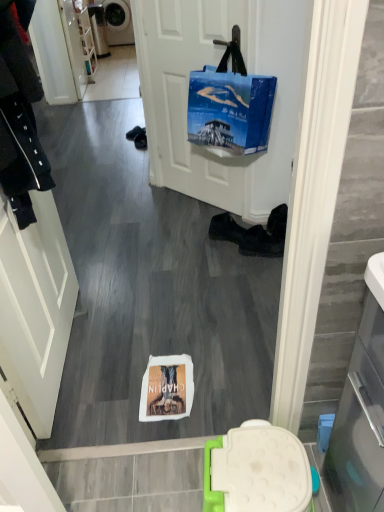
Question: From a real-world perspective, relative to white glossy door at left, is black leather shoe at lower center vertically above or below?

Choices:
 (A) below
 (B) above

Answer: (A)

Question: Considering the positions of point (274, 216) and point (33, 364), is point (274, 216) closer or farther from the camera than point (33, 364)?

Choices:
 (A) farther
 (B) closer

Answer: (A)

Question: Which object is positioned farthest from the white matte door at center?

Choices:
 (A) metallic gray washing machine at upper left
 (B) black leather shoe at lower center
 (C) black leather shoes at center, which ranks as the first footwear in left-to-right order
 (D) white glossy door at left
 (E) black leather boots at lower center, arranged as the 1th footwear when viewed from the right

Answer: (A)

Question: Estimate the real-world distances between objects in this image. Which object is farther from the matte white cabinet at upper left?

Choices:
 (A) blue fabric bag at upper center
 (B) white matte door at center
 (C) black leather boots at lower center, the second footwear positioned from the left
 (D) black leather shoe at lower center
 (E) black leather shoes at center, which ranks as the first footwear in left-to-right order

Answer: (D)